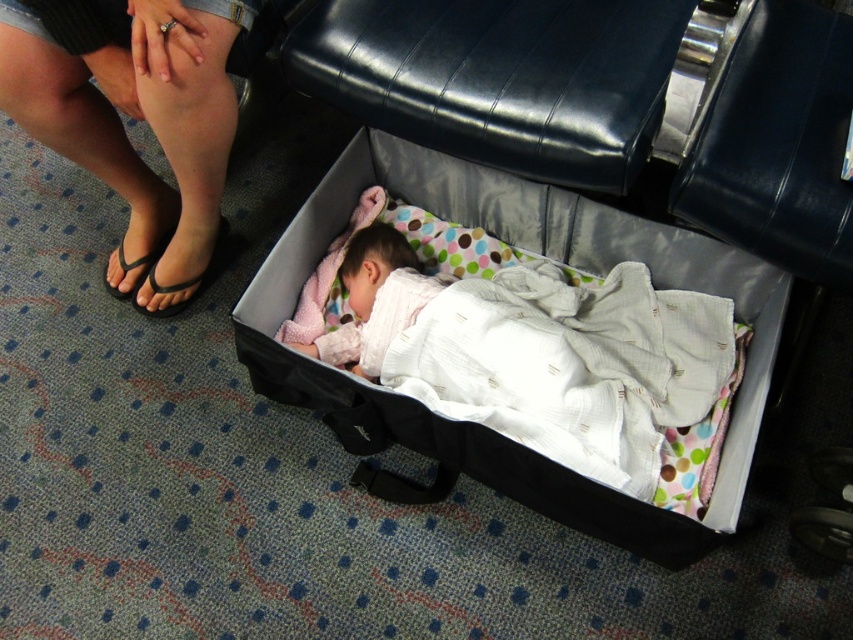
You are standing in the airport scene. There is a black flip flop at lower left represented by point (141, 236). Where is the black flip flop located relative to the baby in the open black suitcase?

The black flip flop at lower left represented by point (141, 236) is located to the left of the baby in the open black suitcase.